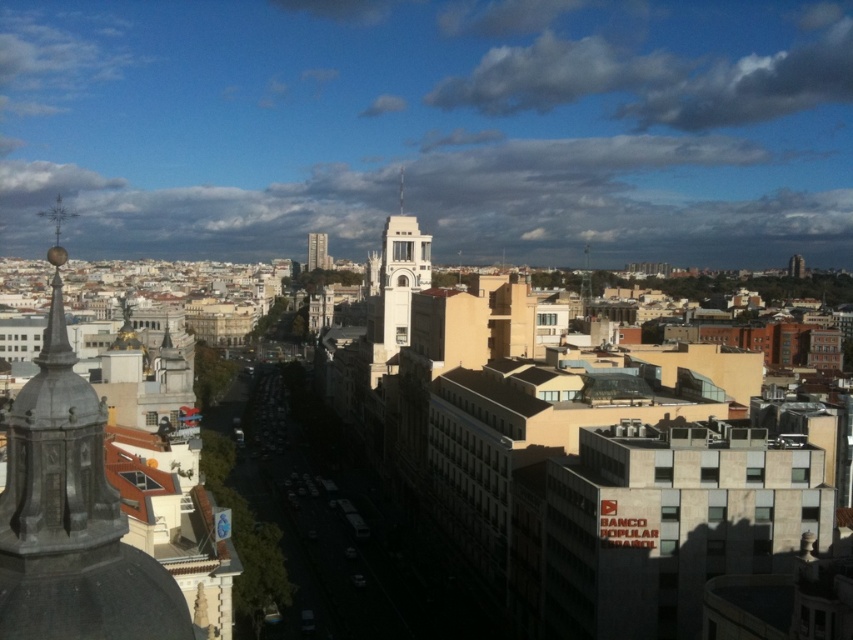
Is point (405, 273) more distant than point (401, 211)?

No, it is not.

Does white concrete tower at center appear on the left side of silver metallic spire at center?

No, white concrete tower at center is not to the left of silver metallic spire at center.

Find the location of `white concrete tower at center`. white concrete tower at center is located at coordinates (395, 292).

Find the location of a particular element. The height and width of the screenshot is (640, 853). white concrete tower at center is located at coordinates (395, 292).

Does white concrete tower at center have a larger size compared to smooth glass skyscraper at center?

Yes.

Does point (412, 220) come farther from viewer compared to point (320, 243)?

No, it is not.

Describe the element at coordinates (395, 292) in the screenshot. I see `white concrete tower at center` at that location.

The height and width of the screenshot is (640, 853). Find the location of `white concrete tower at center`. white concrete tower at center is located at coordinates (395, 292).

In the scene shown: Can you confirm if smooth glass skyscraper at center is wider than silver metallic spire at center?

Yes.

Based on the photo, does smooth glass skyscraper at center have a greater height compared to silver metallic spire at center?

In fact, smooth glass skyscraper at center may be shorter than silver metallic spire at center.

Who is more forward, (314,234) or (401,202)?

Point (314,234) is more forward.

At what (x,y) coordinates should I click in order to perform the action: click on smooth glass skyscraper at center. Please return your answer as a coordinate pair (x, y). The width and height of the screenshot is (853, 640). Looking at the image, I should click on point(317,252).